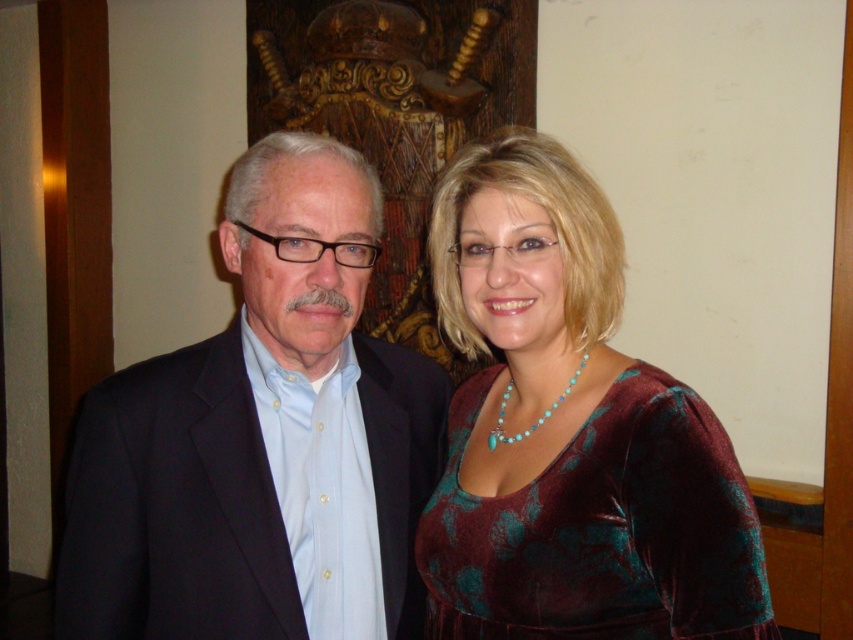
You are a photographer at a formal event. You want to capture a photo where the velvet dress at center is clearly visible without being blocked by the matte black suit at left. Which individual should you position closer to the camera to achieve this?

The velvet dress at center is behind the matte black suit at left, so to ensure it is visible and not blocked, you should position the individual wearing the matte black suit at left closer to the camera than the velvet dress at center.

Based on the photo, you are standing at point [563,202] and want to walk straight ahead. Will you collide with the point [386,486]?

Point [386,486] is behind point [563,202], so walking straight ahead from point [563,202] will not lead to a collision with point [386,486].